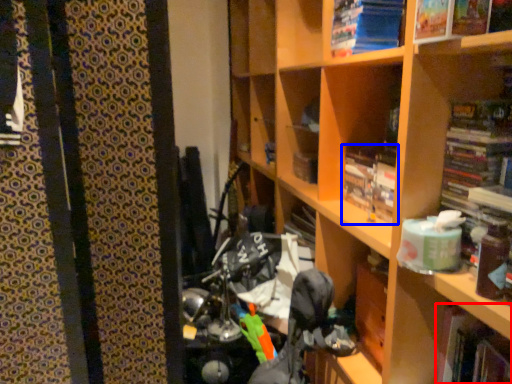
Question: Among these objects, which one is farthest to the camera, book (highlighted by a red box) or book (highlighted by a blue box)?

Choices:
 (A) book
 (B) book

Answer: (B)